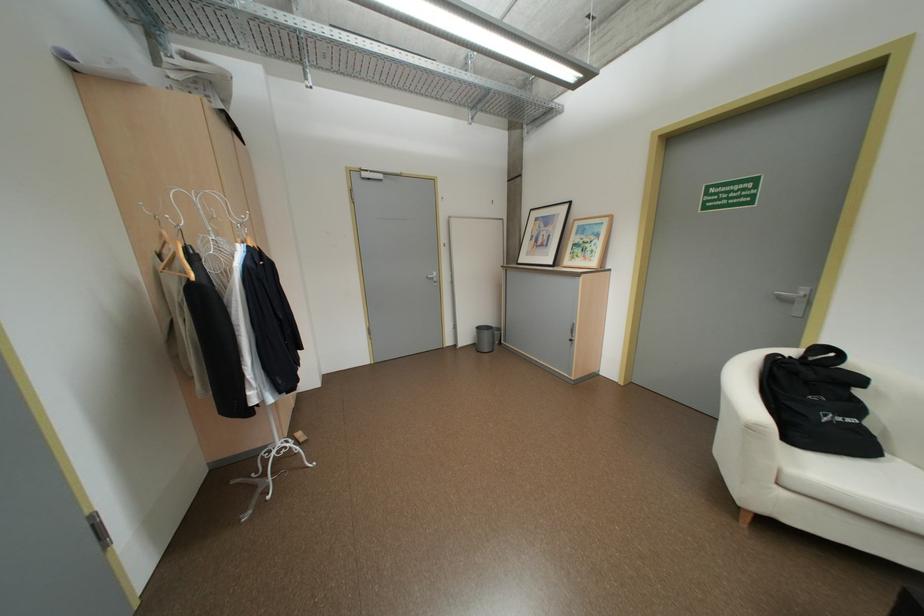
Describe the element at coordinates (793, 416) in the screenshot. I see `a sofa armrest` at that location.